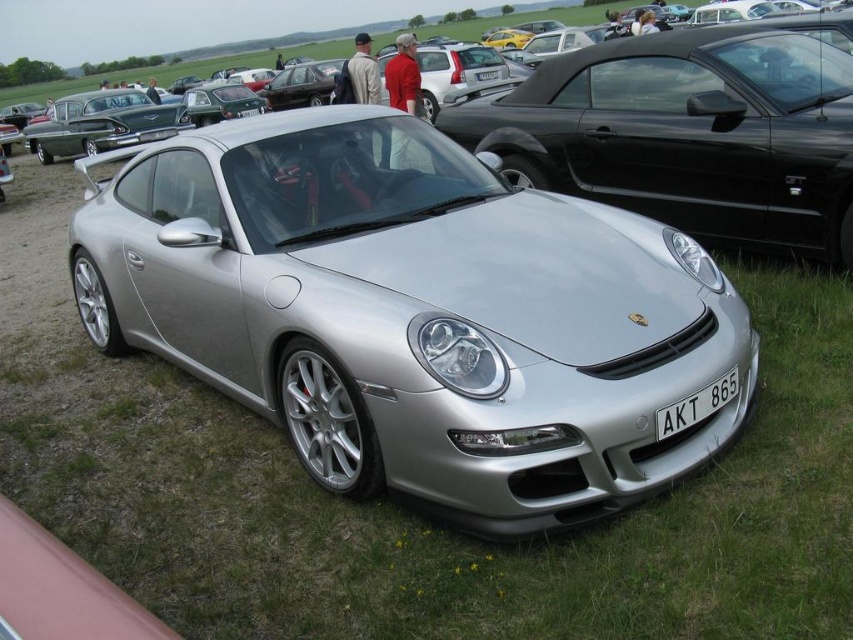
Can you confirm if silver metallic car at center is bigger than white plastic license plate at front?

Correct, silver metallic car at center is larger in size than white plastic license plate at front.

Does silver metallic car at center have a greater width compared to white plastic license plate at front?

Indeed, silver metallic car at center has a greater width compared to white plastic license plate at front.

The height and width of the screenshot is (640, 853). I want to click on silver metallic car at center, so pyautogui.click(x=686, y=132).